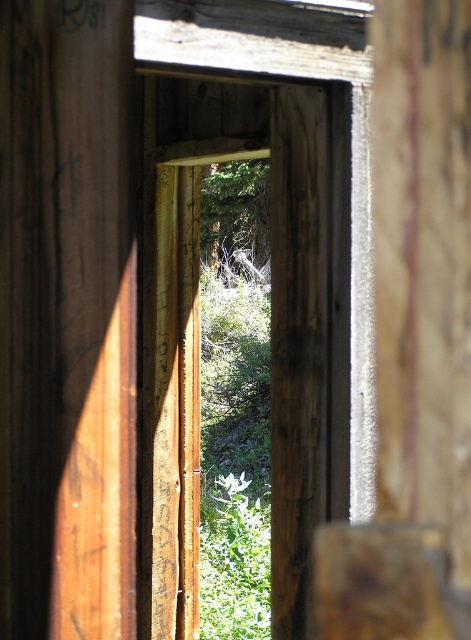
Does weathered wood frame at center appear over green leafy tree at center?

Actually, weathered wood frame at center is below green leafy tree at center.

What do you see at coordinates (268, 268) in the screenshot? I see `weathered wood frame at center` at bounding box center [268, 268].

I want to click on weathered wood frame at center, so click(x=268, y=268).